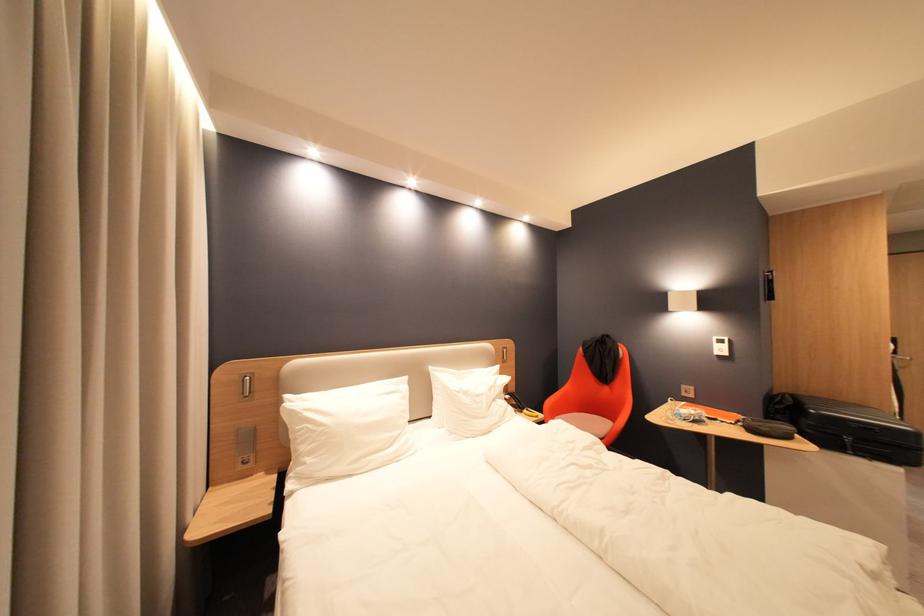
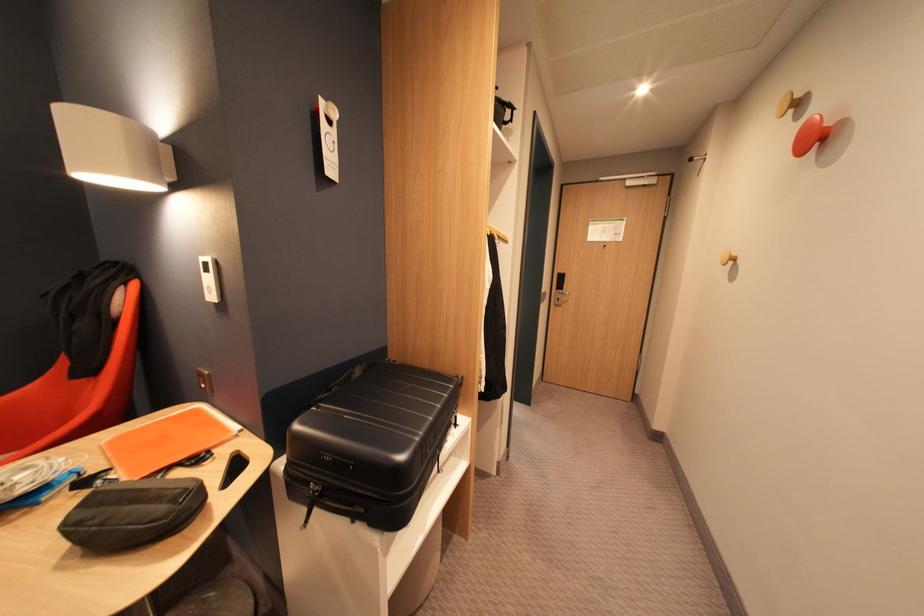
Locate, in the second image, the point that corresponds to the point at 734,341 in the first image.

(216, 265)